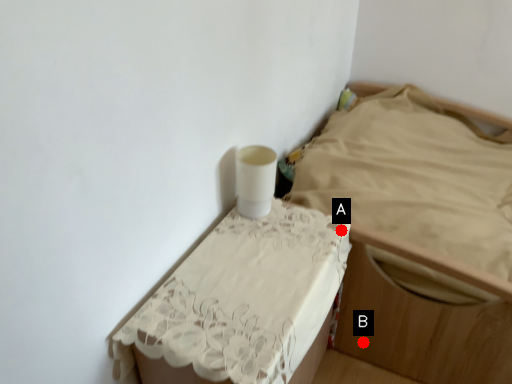
Question: Two points are circled on the image, labeled by A and B beside each circle. Which point is closer to the camera taking this photo?

Choices:
 (A) A is closer
 (B) B is closer

Answer: (A)